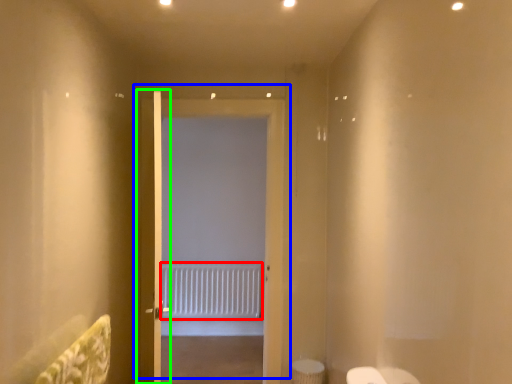
Question: Considering the real-world distances, which object is farthest from radiator (highlighted by a red box)? door (highlighted by a blue box) or door (highlighted by a green box)?

Choices:
 (A) door
 (B) door

Answer: (B)